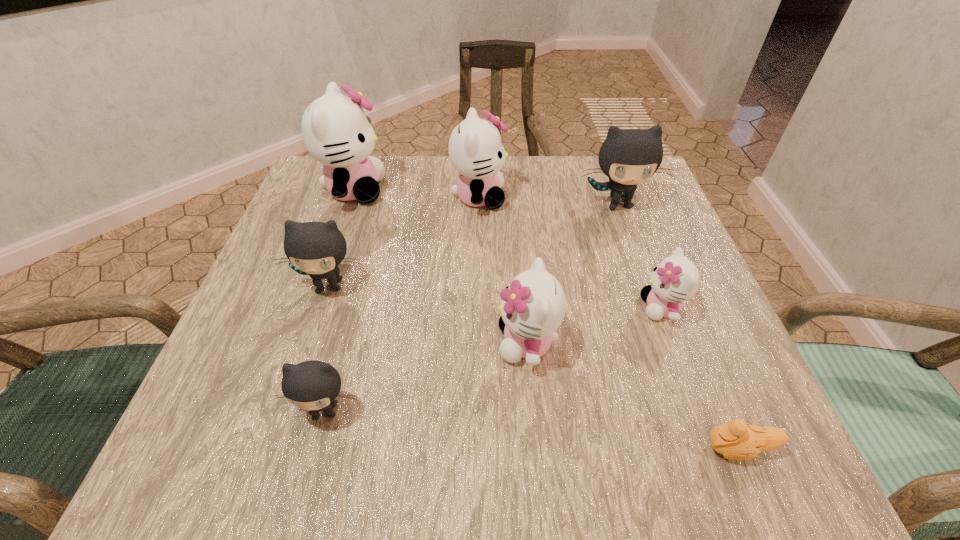
The height and width of the screenshot is (540, 960). Identify the location of vacant area between the third smallest white kitten and the second biggest gray kitten. (404, 241).

Locate an element on the screen. This screenshot has width=960, height=540. free space between the second smallest white kitten and the second biggest white kitten is located at coordinates (503, 269).

Where is `vacant area that lies between the shortest object and the nearest kitten`? vacant area that lies between the shortest object and the nearest kitten is located at coordinates (532, 429).

Locate an element on the screen. Image resolution: width=960 pixels, height=540 pixels. free space between the smallest gray kitten and the tallest object is located at coordinates (340, 300).

The height and width of the screenshot is (540, 960). In order to click on free point between the third smallest white kitten and the tallest kitten in this screenshot , I will do `click(417, 193)`.

In order to click on free area in between the third smallest white kitten and the third biggest white kitten in this screenshot , I will do `click(503, 269)`.

Where is `free area in between the second biggest white kitten and the rightmost gray kitten`? The width and height of the screenshot is (960, 540). free area in between the second biggest white kitten and the rightmost gray kitten is located at coordinates (548, 200).

Select which object appears as the third closest to the nearest object. Please provide its 2D coordinates. Your answer should be formatted as a tuple, i.e. [(x, y)], where the tuple contains the x and y coordinates of a point satisfying the conditions above.

[(313, 385)]

Locate an element on the screen. This screenshot has height=540, width=960. object that is the seventh closest to the second biggest white kitten is located at coordinates (737, 440).

Locate which kitten is the third closest to the farthest gray kitten. Please provide its 2D coordinates. Your answer should be formatted as a tuple, i.e. [(x, y)], where the tuple contains the x and y coordinates of a point satisfying the conditions above.

[(533, 306)]